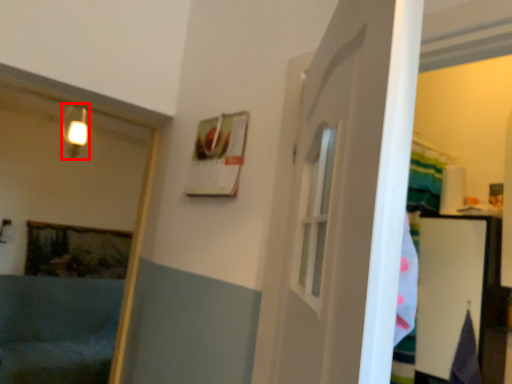
Question: From the image's perspective, considering the relative positions of light fixture (annotated by the red box) and bath in the image provided, where is light fixture (annotated by the red box) located with respect to the staircase?

Choices:
 (A) above
 (B) below

Answer: (A)